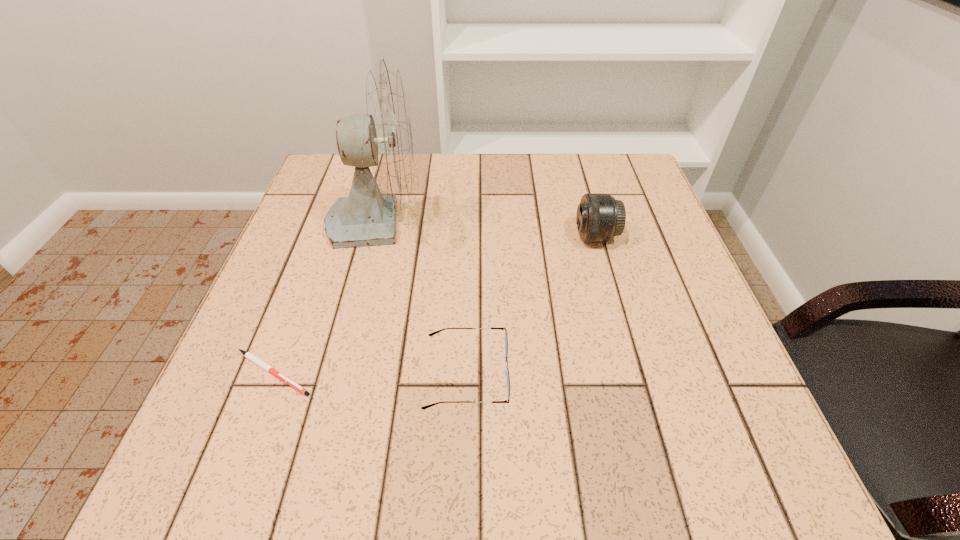
Locate an element on the screen. vacant area that lies between the tallest object and the pen is located at coordinates (324, 296).

You are a GUI agent. You are given a task and a screenshot of the screen. Output one action in this format:
    pyautogui.click(x=<x>, y=<y>)
    Task: Click on the free spot between the rightmost object and the second shortest object
    
    Given the screenshot: What is the action you would take?
    pyautogui.click(x=531, y=305)

Image resolution: width=960 pixels, height=540 pixels. I want to click on the second closest object to the tallest object, so click(x=248, y=355).

I want to click on object that is the third closest to the tallest object, so click(600, 217).